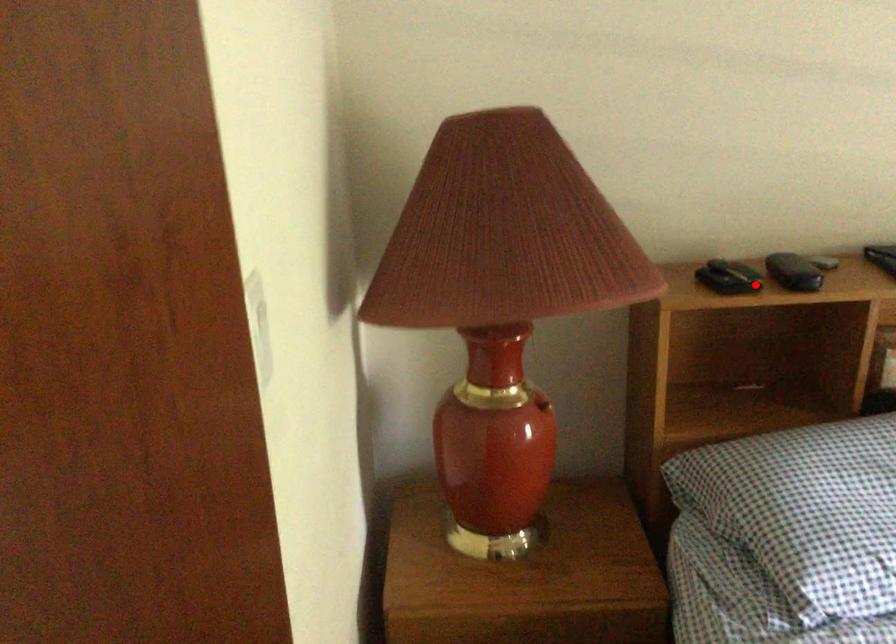
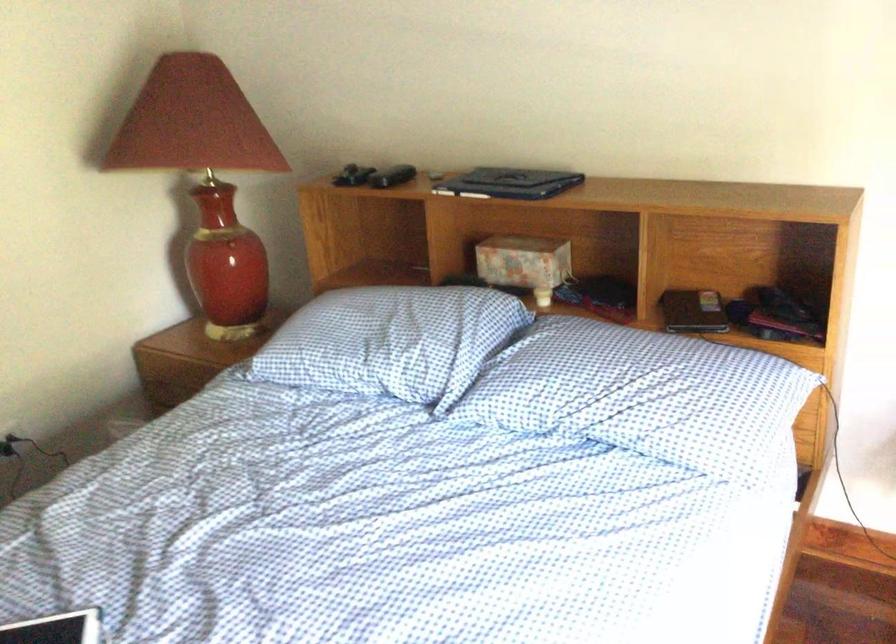
Question: I am providing you with two images of the same scene from different viewpoints. In image1, a red point is highlighted. Considering the same 3D point in image2, which of the following is correct?

Choices:
 (A) It is closer
 (B) It is farther

Answer: (B)